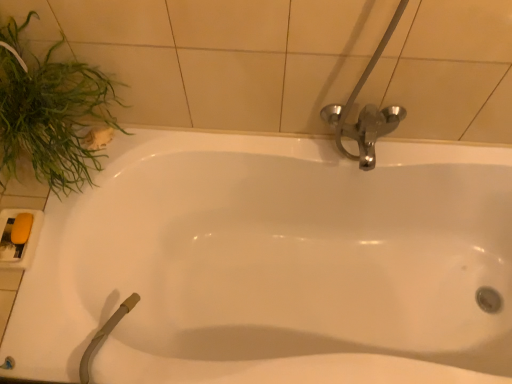
This screenshot has height=384, width=512. In order to click on white glossy bathtub at center in this screenshot , I will do `click(274, 265)`.

The width and height of the screenshot is (512, 384). Describe the element at coordinates (274, 265) in the screenshot. I see `white glossy bathtub at center` at that location.

Locate an element on the screen. The height and width of the screenshot is (384, 512). white glossy bathtub at center is located at coordinates (274, 265).

In order to click on bathtub that is on the right side of green leafy plant at left in this screenshot , I will do `click(274, 265)`.

Is there a large distance between green leafy plant at left and white glossy bathtub at center?

No, there isn't a large distance between green leafy plant at left and white glossy bathtub at center.

From the image's perspective, which object appears higher, green leafy plant at left or white glossy bathtub at center?

From the image's view, green leafy plant at left is above.

Does point (19, 52) come farther from viewer compared to point (483, 222)?

No, (19, 52) is closer to viewer.

From the image's perspective, between yellow matte soap at lower left and white glossy bathtub at center, which one is located above?

yellow matte soap at lower left is shown above in the image.

The image size is (512, 384). Identify the location of soap that is behind the white glossy bathtub at center. (21, 228).

Is the surface of yellow matte soap at lower left in direct contact with white glossy bathtub at center?

No, yellow matte soap at lower left is not beside white glossy bathtub at center.

Relative to white glossy bathtub at center, is yellow matte soap at lower left in front or behind?

yellow matte soap at lower left is behind white glossy bathtub at center.

Which object is wider, green leafy plant at left or yellow matte soap at lower left?

green leafy plant at left is wider.

Who is taller, green leafy plant at left or yellow matte soap at lower left?

green leafy plant at left is taller.

Where is `soap located underneath the green leafy plant at left (from a real-world perspective)`? This screenshot has height=384, width=512. soap located underneath the green leafy plant at left (from a real-world perspective) is located at coordinates (21, 228).

Based on the photo, is green leafy plant at left facing towards yellow matte soap at lower left?

No, green leafy plant at left does not turn towards yellow matte soap at lower left.

Considering the relative sizes of white glossy bathtub at center and yellow matte soap at lower left in the image provided, is white glossy bathtub at center shorter than yellow matte soap at lower left?

In fact, white glossy bathtub at center may be taller than yellow matte soap at lower left.

From the image's perspective, is white glossy bathtub at center positioned above or below yellow matte soap at lower left?

From the image's perspective, white glossy bathtub at center appears below yellow matte soap at lower left.

Is white glossy bathtub at center oriented towards yellow matte soap at lower left?

No, white glossy bathtub at center does not turn towards yellow matte soap at lower left.

Is white glossy bathtub at center positioned far away from yellow matte soap at lower left?

That's not correct — white glossy bathtub at center is a little close to yellow matte soap at lower left.

What's the angular difference between white glossy bathtub at center and green leafy plant at left's facing directions?

They differ by 90 degrees in their facing directions.

Is white glossy bathtub at center oriented towards green leafy plant at left?

No, white glossy bathtub at center does not turn towards green leafy plant at left.

Is white glossy bathtub at center in front of or behind green leafy plant at left in the image?

Visually, white glossy bathtub at center is located behind green leafy plant at left.

Based on their sizes in the image, would you say white glossy bathtub at center is bigger or smaller than green leafy plant at left?

Considering their sizes, white glossy bathtub at center takes up more space than green leafy plant at left.

Which is more to the right, yellow matte soap at lower left or green leafy plant at left?

green leafy plant at left.

From a real-world perspective, which is physically above, yellow matte soap at lower left or green leafy plant at left?

green leafy plant at left, from a real-world perspective.

Considering the positions of objects yellow matte soap at lower left and green leafy plant at left in the image provided, who is behind, yellow matte soap at lower left or green leafy plant at left?

yellow matte soap at lower left is behind.

The image size is (512, 384). In the image, there is a yellow matte soap at lower left. Find the location of `plant above it (from the image's perspective)`. plant above it (from the image's perspective) is located at coordinates (52, 118).

This screenshot has width=512, height=384. In order to click on plant above the white glossy bathtub at center (from a real-world perspective) in this screenshot , I will do `click(52, 118)`.

Find the location of a particular element. bathtub on the right of yellow matte soap at lower left is located at coordinates (274, 265).

Considering their positions, is green leafy plant at left positioned closer to white glossy bathtub at center than yellow matte soap at lower left?

green leafy plant at left lies closer to white glossy bathtub at center than the other object.

Looking at the image, which one is located closer to white glossy bathtub at center, yellow matte soap at lower left or green leafy plant at left?

green leafy plant at left.

In the scene shown: Which object lies further to the anchor point green leafy plant at left, yellow matte soap at lower left or white glossy bathtub at center?

white glossy bathtub at center is positioned further to the anchor green leafy plant at left.

When comparing their distances from yellow matte soap at lower left, does white glossy bathtub at center or green leafy plant at left seem closer?

green leafy plant at left.

Which object lies nearer to the anchor point green leafy plant at left, white glossy bathtub at center or yellow matte soap at lower left?

yellow matte soap at lower left lies closer to green leafy plant at left than the other object.

Which object lies nearer to the anchor point yellow matte soap at lower left, green leafy plant at left or white glossy bathtub at center?

green leafy plant at left.

You are a GUI agent. You are given a task and a screenshot of the screen. Output one action in this format:
    pyautogui.click(x=<x>, y=<y>)
    Task: Click on the plant between yellow matte soap at lower left and white glossy bathtub at center from left to right
    This screenshot has height=384, width=512.
    Given the screenshot: What is the action you would take?
    pyautogui.click(x=52, y=118)